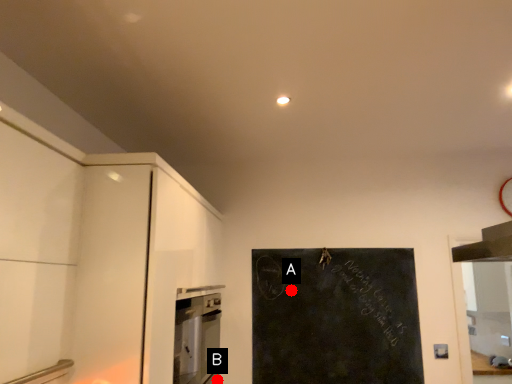
Question: Two points are circled on the image, labeled by A and B beside each circle. Which point is closer to the camera?

Choices:
 (A) A is closer
 (B) B is closer

Answer: (B)